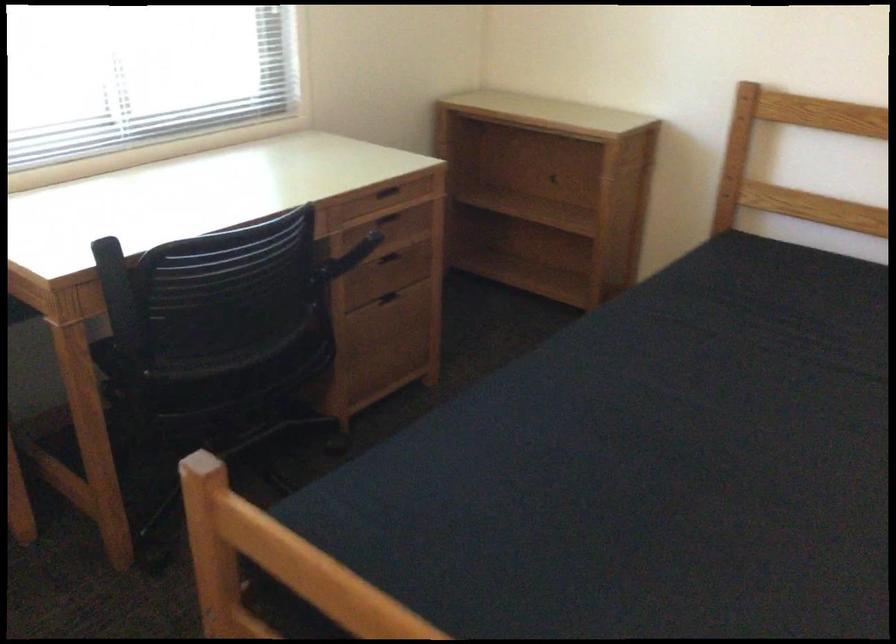
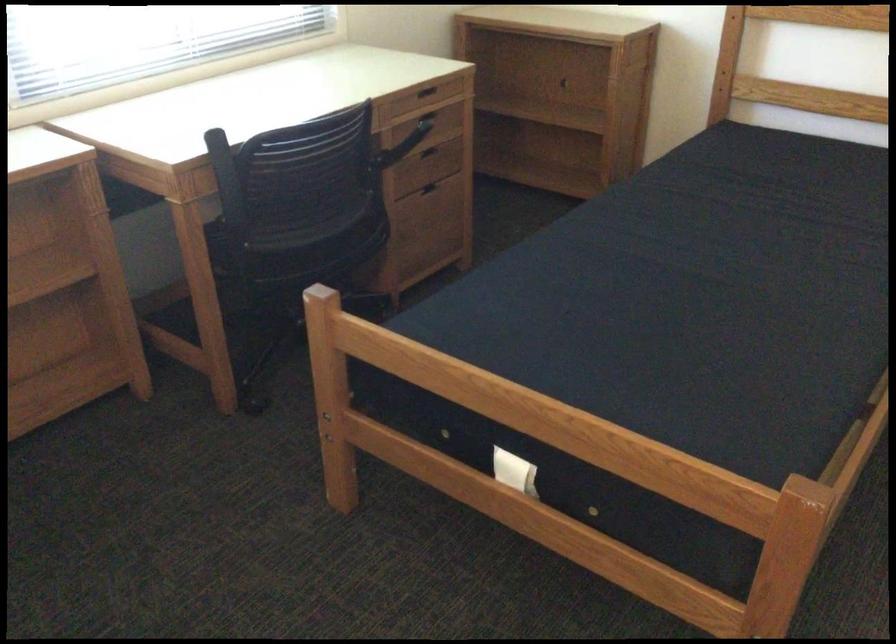
Where in the second image is the point corresponding to the point at 117,301 from the first image?

(227, 182)